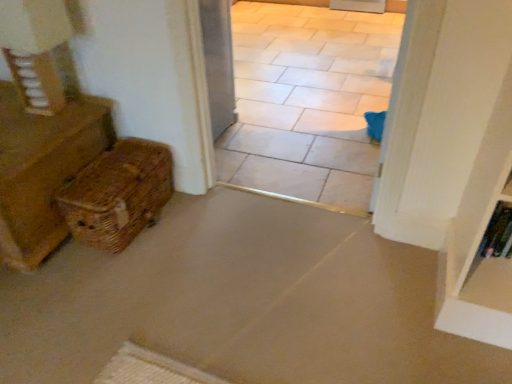
Where is `woven brown basket at left`? woven brown basket at left is located at coordinates (118, 194).

The image size is (512, 384). What do you see at coordinates (118, 194) in the screenshot? I see `woven brown basket at left` at bounding box center [118, 194].

Locate an element on the screen. woven brown basket at left is located at coordinates (118, 194).